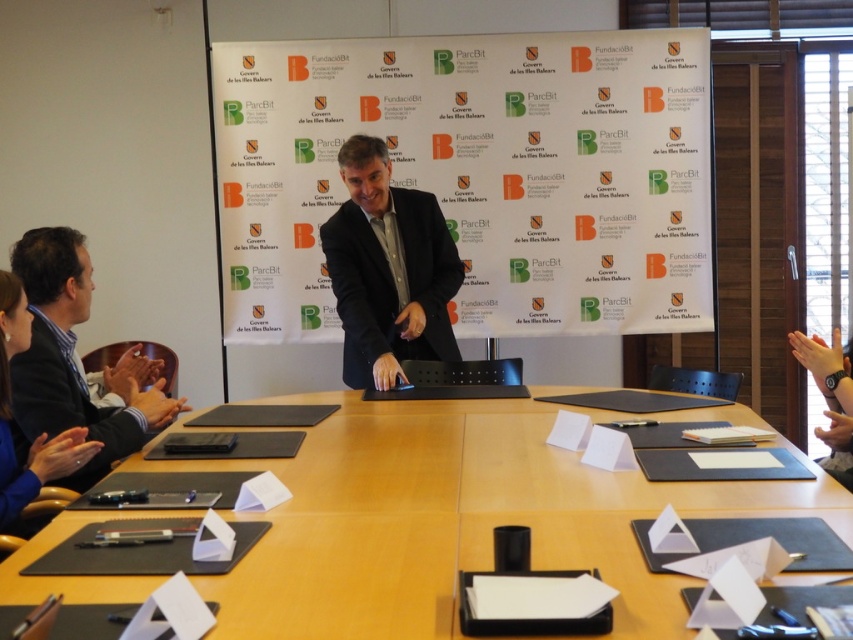
You are an event organizer who needs to ensure that the white paperboard at center and the black matte suit at center are visible to all attendees. Based on their sizes, which object would be easier to see from the back of the room?

The white paperboard at center has a larger width than the black matte suit at center, so it would be easier to see from the back of the room.

You are attending a formal meeting and notice two items of clothing in the scene. The black matte suit at center and the blue fabric shirt at lower left. Which one is positioned higher up in the image?

The black matte suit at center is positioned higher up in the image as it is above the blue fabric shirt at lower left.

You are sitting at the conference table and need to locate the white paperboard at center. According to the room layout, where should you look to find it?

The white paperboard at center is located at the 2D coordinates point (477, 173) in the room layout.